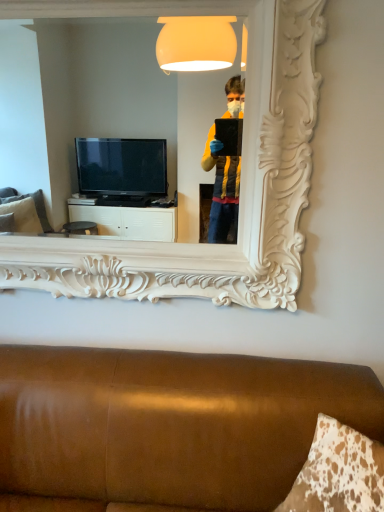
Question: Visually, is white carved mirror at upper center positioned to the left or to the right of brown leather couch at lower center?

Choices:
 (A) left
 (B) right

Answer: (A)

Question: Is point (104, 292) positioned closer to the camera than point (235, 384)?

Choices:
 (A) closer
 (B) farther

Answer: (B)

Question: Which is correct: white carved mirror at upper center is inside brown leather couch at lower center, or outside of it?

Choices:
 (A) outside
 (B) inside

Answer: (A)

Question: Is point (264, 401) positioned closer to the camera than point (253, 252)?

Choices:
 (A) farther
 (B) closer

Answer: (B)

Question: From a real-world perspective, is brown leather couch at lower center positioned above or below white carved mirror at upper center?

Choices:
 (A) below
 (B) above

Answer: (A)

Question: In the image, is brown leather couch at lower center positioned in front of or behind white carved mirror at upper center?

Choices:
 (A) front
 (B) behind

Answer: (A)

Question: From the image's perspective, is brown leather couch at lower center located above or below white carved mirror at upper center?

Choices:
 (A) above
 (B) below

Answer: (B)